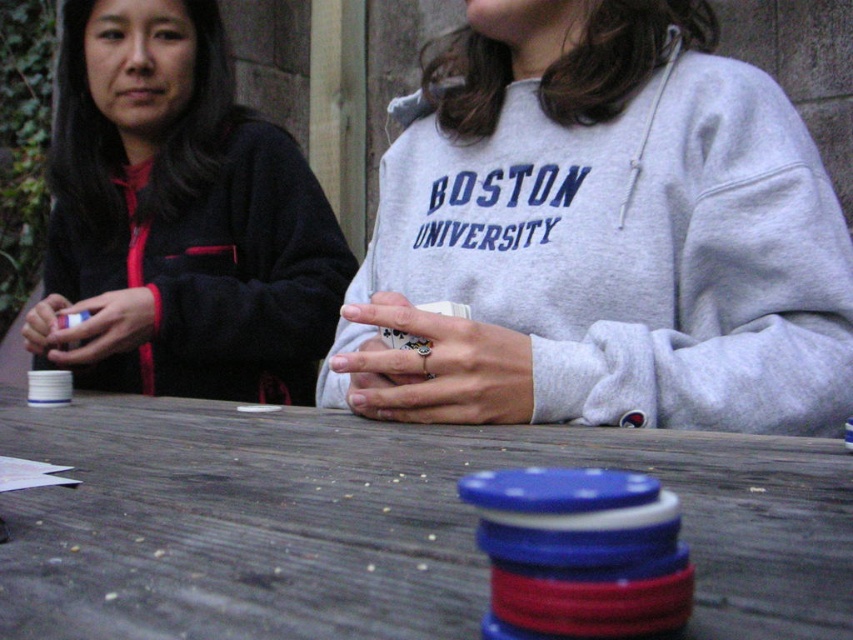
Question: Is wooden table at center positioned before dark blue fleece jacket at left?

Choices:
 (A) no
 (B) yes

Answer: (B)

Question: Which point is closer to the camera taking this photo?

Choices:
 (A) (627, 243)
 (B) (218, 588)

Answer: (B)

Question: Observing the image, what is the correct spatial positioning of wooden table at center in reference to dark blue fleece jacket at left?

Choices:
 (A) above
 (B) below

Answer: (B)

Question: Which is farther from the wooden table at center?

Choices:
 (A) gray cotton sweatshirt at center
 (B) dark blue fleece jacket at left

Answer: (B)

Question: Which point appears farthest from the camera in this image?

Choices:
 (A) (323, 328)
 (B) (746, 518)
 (C) (700, 134)

Answer: (A)

Question: Is gray cotton sweatshirt at center to the right of wooden table at center from the viewer's perspective?

Choices:
 (A) yes
 (B) no

Answer: (A)